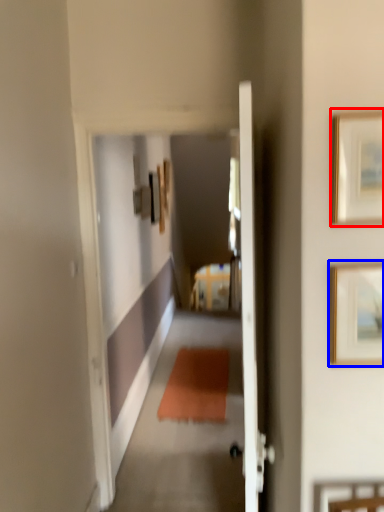
Question: Which point is closer to the camera, picture frame (highlighted by a red box) or picture frame (highlighted by a blue box)?

Choices:
 (A) picture frame
 (B) picture frame

Answer: (A)